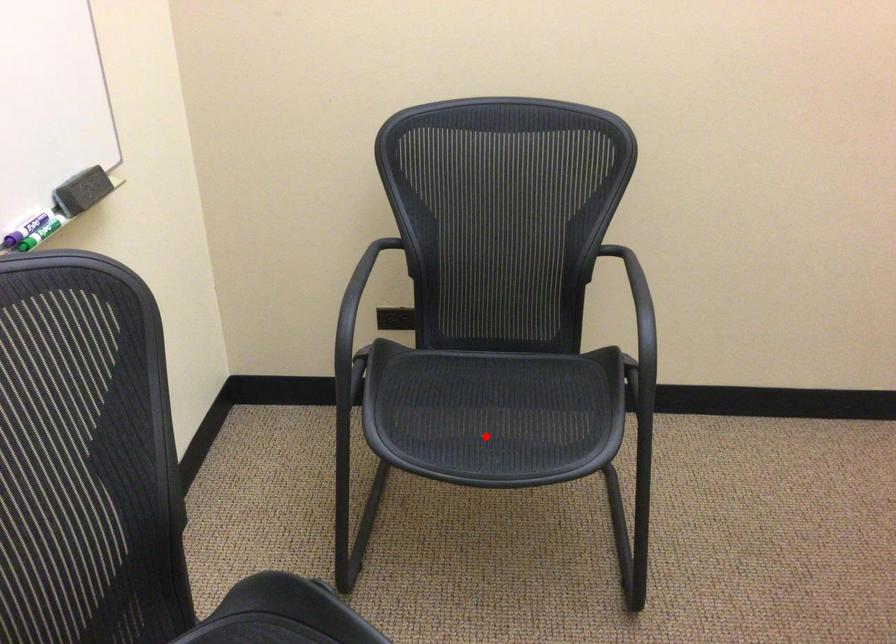
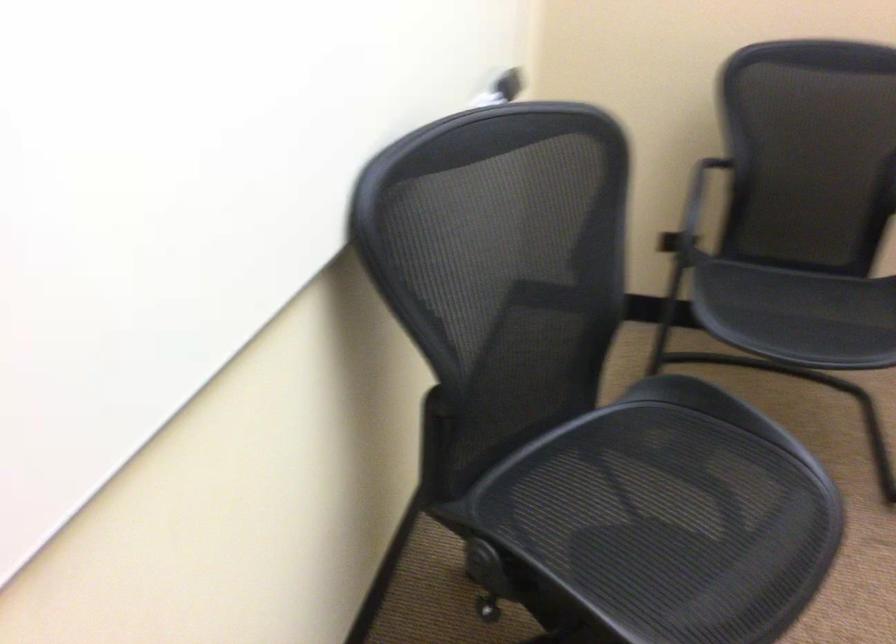
Find the pixel in the second image that matches the highlighted location in the first image.

(798, 315)